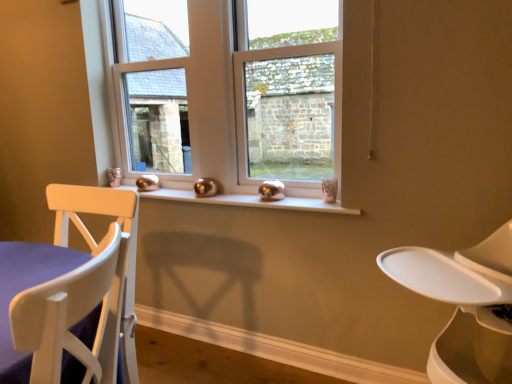
Measure the distance between clear glass window at center and camera.

A distance of 1.60 meters exists between clear glass window at center and camera.

What do you see at coordinates (252, 201) in the screenshot?
I see `white glossy window sill at center` at bounding box center [252, 201].

Where is `white plastic feeding chair at right`? The image size is (512, 384). white plastic feeding chair at right is located at coordinates (464, 305).

Which of these two, white wood chair at left or clear glass window at center, stands taller?

clear glass window at center is taller.

Is white wood chair at left facing away from clear glass window at center?

white wood chair at left is not turned away from clear glass window at center.

From a real-world perspective, relative to clear glass window at center, is white wood chair at left vertically above or below?

Clearly, from a real-world perspective, white wood chair at left is below clear glass window at center.

Is white plastic feeding chair at right wider or thinner than clear glass window at center?

Clearly, white plastic feeding chair at right has more width compared to clear glass window at center.

Is white plastic feeding chair at right inside the boundaries of clear glass window at center, or outside?

white plastic feeding chair at right exists outside the volume of clear glass window at center.

Is point (381, 258) closer to camera compared to point (255, 113)?

Yes, it is.

Is white plastic feeding chair at right completely or partially inside clear glass window at center?

No, white plastic feeding chair at right is not a part of clear glass window at center.

Considering the positions of objects clear glass window at center and white plastic feeding chair at right in the image provided, who is more to the right, clear glass window at center or white plastic feeding chair at right?

Positioned to the right is white plastic feeding chair at right.

Looking at this image, is clear glass window at center far away from white plastic feeding chair at right?

Indeed, clear glass window at center is not near white plastic feeding chair at right.

How many degrees apart are the facing directions of white plastic feeding chair at right and white wood chair at left?

The angular difference between white plastic feeding chair at right and white wood chair at left is 6.23 degrees.

Considering the sizes of objects white plastic feeding chair at right and white wood chair at left in the image provided, who is thinner, white plastic feeding chair at right or white wood chair at left?

white wood chair at left is thinner.

Between white plastic feeding chair at right and white wood chair at left, which one appears on the left side from the viewer's perspective?

Positioned to the left is white wood chair at left.

From the image's perspective, does white plastic feeding chair at right appear lower than white wood chair at left?

No, from the image's perspective, white plastic feeding chair at right is not below white wood chair at left.

Between clear glass window at center and clear glass window at center, which one appears on the right side from the viewer's perspective?

Positioned to the right is clear glass window at center.

Who is bigger, clear glass window at center or clear glass window at center?

With larger size is clear glass window at center.

Is the surface of clear glass window at center in direct contact with clear glass window at center?

There is a gap between clear glass window at center and clear glass window at center.

From the picture: From the image's perspective, is clear glass window at center located above or below clear glass window at center?

Clearly, from the image's perspective, clear glass window at center is above clear glass window at center.

Is clear glass window at center smaller than white wood chair at left?

Correct, clear glass window at center occupies less space than white wood chair at left.

Is clear glass window at center beside white wood chair at left?

No, clear glass window at center is not touching white wood chair at left.

Looking at this image, considering the sizes of objects clear glass window at center and white wood chair at left in the image provided, who is taller, clear glass window at center or white wood chair at left?

With more height is clear glass window at center.

Is white wood chair at left surrounded by clear glass window at center?

No.

Would you consider white glossy window sill at center to be distant from white plastic feeding chair at right?

No, white glossy window sill at center is not far away from white plastic feeding chair at right.

Which of these two, white glossy window sill at center or white plastic feeding chair at right, is wider?

Wider between the two is white plastic feeding chair at right.

Considering the sizes of white glossy window sill at center and white plastic feeding chair at right in the image, is white glossy window sill at center taller or shorter than white plastic feeding chair at right?

Considering their sizes, white glossy window sill at center has less height than white plastic feeding chair at right.

Is white glossy window sill at center closer to the viewer compared to white plastic feeding chair at right?

No, white glossy window sill at center is further to the viewer.

Find the location of a particular element. window that is above the white wood chair at left (from the image's perspective) is located at coordinates (288, 90).

Where is `window located behind the white plastic feeding chair at right`? The image size is (512, 384). window located behind the white plastic feeding chair at right is located at coordinates (288, 90).

Considering their positions, is white wood chair at left positioned closer to clear glass window at center than white glossy window sill at center?

white glossy window sill at center lies closer to clear glass window at center than the other object.

When comparing their distances from white glossy window sill at center, does clear glass window at center or white wood chair at left seem further?

Based on the image, white wood chair at left appears to be further to white glossy window sill at center.

Which object lies nearer to the anchor point clear glass window at center, white plastic feeding chair at right or white glossy window sill at center?

Among the two, white glossy window sill at center is located nearer to clear glass window at center.

Based on their spatial positions, is white plastic feeding chair at right or clear glass window at center closer to clear glass window at center?

clear glass window at center.

Looking at the image, which one is located further to white glossy window sill at center, white wood chair at left or clear glass window at center?

white wood chair at left is positioned further to the anchor white glossy window sill at center.

Which object lies further to the anchor point clear glass window at center, white plastic feeding chair at right or white wood chair at left?

white plastic feeding chair at right is positioned further to the anchor clear glass window at center.

When comparing their distances from white wood chair at left, does clear glass window at center or white glossy window sill at center seem further?

clear glass window at center is further to white wood chair at left.

Considering their positions, is white glossy window sill at center positioned closer to clear glass window at center than white wood chair at left?

white glossy window sill at center is positioned closer to the anchor clear glass window at center.

I want to click on window sill located between clear glass window at center and clear glass window at center in the left-right direction, so click(252, 201).

The image size is (512, 384). Identify the location of window sill between white plastic feeding chair at right and clear glass window at center from front to back. (252, 201).

This screenshot has height=384, width=512. I want to click on window between white plastic feeding chair at right and clear glass window at center in the front-back direction, so click(288, 90).

This screenshot has height=384, width=512. In order to click on window between clear glass window at center and white wood chair at left in the up-down direction in this screenshot , I will do `click(288, 90)`.